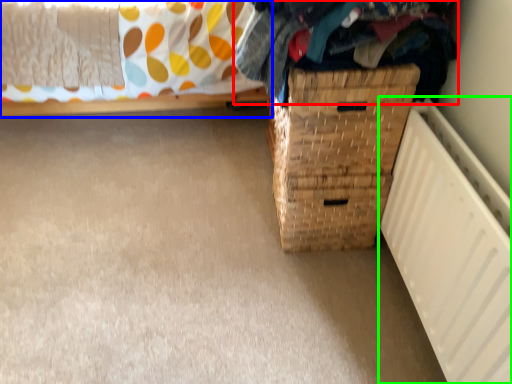
Question: Considering the real-world distances, which object is closest to clothing (highlighted by a red box)? furniture (highlighted by a blue box) or radiator (highlighted by a green box).

Choices:
 (A) furniture
 (B) radiator

Answer: (B)